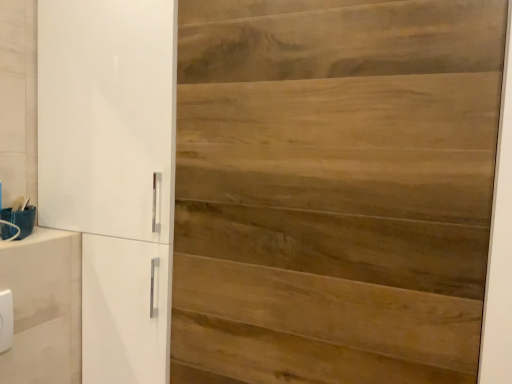
Question: Is white glossy cupboard at left located outside wooden door at center?

Choices:
 (A) yes
 (B) no

Answer: (A)

Question: Is wooden door at center at the back of white glossy cupboard at left?

Choices:
 (A) yes
 (B) no

Answer: (B)

Question: Is the depth of white glossy cupboard at left less than that of wooden door at center?

Choices:
 (A) no
 (B) yes

Answer: (A)

Question: Does white glossy cupboard at left have a greater height compared to wooden door at center?

Choices:
 (A) yes
 (B) no

Answer: (A)

Question: Are white glossy cupboard at left and wooden door at center located far from each other?

Choices:
 (A) no
 (B) yes

Answer: (A)

Question: Does white glossy cupboard at left have a greater width compared to wooden door at center?

Choices:
 (A) no
 (B) yes

Answer: (B)

Question: Is wooden door at center at the right side of white glossy cupboard at left?

Choices:
 (A) yes
 (B) no

Answer: (A)

Question: From a real-world perspective, is wooden door at center located higher than white glossy cupboard at left?

Choices:
 (A) no
 (B) yes

Answer: (B)

Question: Can you confirm if wooden door at center is bigger than white glossy cupboard at left?

Choices:
 (A) yes
 (B) no

Answer: (B)

Question: Considering the relative sizes of wooden door at center and white glossy cupboard at left in the image provided, is wooden door at center thinner than white glossy cupboard at left?

Choices:
 (A) no
 (B) yes

Answer: (B)

Question: Is wooden door at center smaller than white glossy cupboard at left?

Choices:
 (A) yes
 (B) no

Answer: (A)

Question: Is wooden door at center in front of white glossy cupboard at left?

Choices:
 (A) yes
 (B) no

Answer: (A)

Question: Is white plastic/light switch at lower left closer to camera compared to wooden door at center?

Choices:
 (A) no
 (B) yes

Answer: (A)